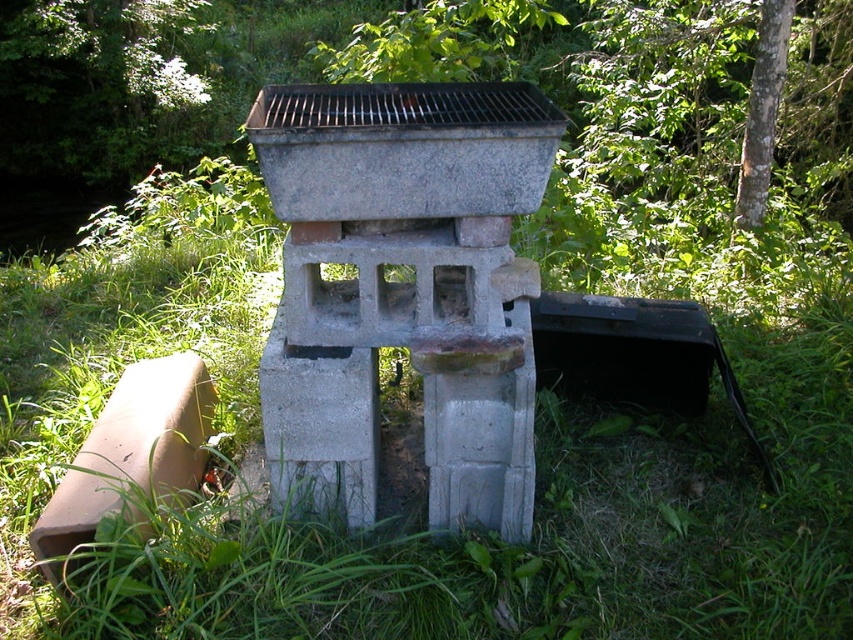
You are standing near the grill and want to know which object is taller between the green grass at center and the green leafy tree at upper center. Can you determine this based on the scene?

The green grass at center is not as tall as the green leafy tree at upper center, so the green leafy tree at upper center is taller.

Looking at this image, you are standing at the origin point of the coordinate system. You want to walk to the green grass at center. Which direction should you go?

The green grass at center is located at coordinate point (x=461, y=538), so you should move towards the northeast direction from your current position at the origin.

You are standing in front of the grill and want to know where the green grass at center is located relative to the green leafy tree at upper center. Can you tell me if the grass is above or below the tree?

The green grass at center is below the green leafy tree at upper center.